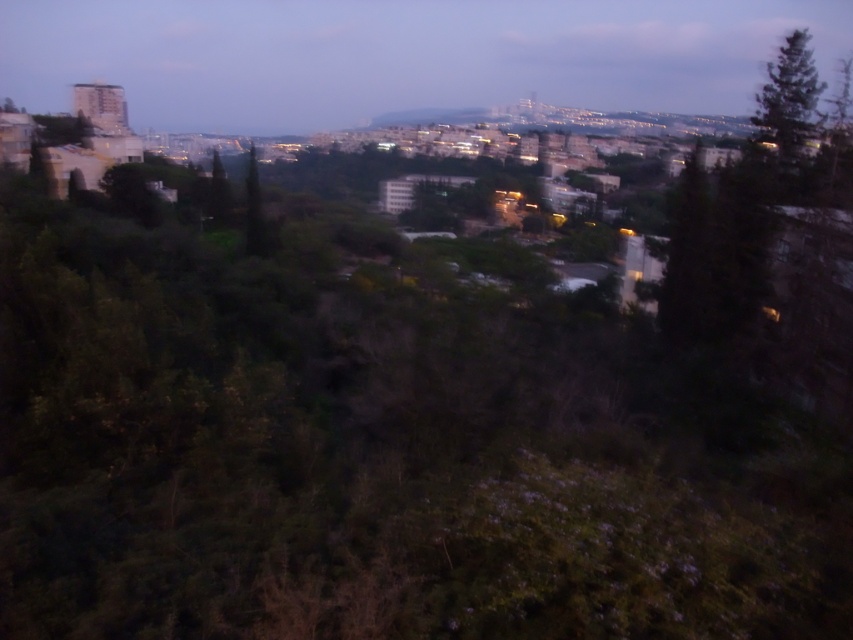
From the picture: Is green textured tree at upper right above green leafy tree at center?

Actually, green textured tree at upper right is below green leafy tree at center.

Does green textured tree at upper right appear on the right side of green leafy tree at center?

Yes, green textured tree at upper right is to the right of green leafy tree at center.

Does point (759, 116) come closer to viewer compared to point (270, 232)?

Yes, point (759, 116) is in front of point (270, 232).

Where is `green textured tree at upper right`? green textured tree at upper right is located at coordinates (788, 96).